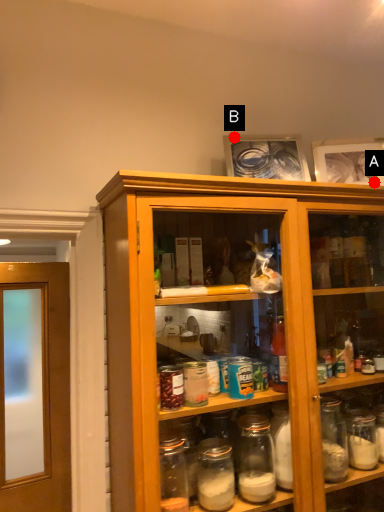
Question: Two points are circled on the image, labeled by A and B beside each circle. Which of the following is the closest to the observer?

Choices:
 (A) A is closer
 (B) B is closer

Answer: (A)